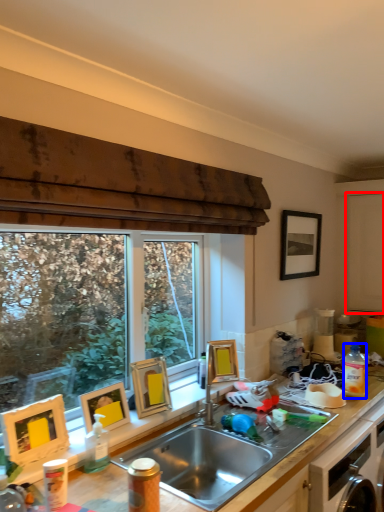
Question: Among these objects, which one is farthest to the camera, screen door (highlighted by a red box) or bottle (highlighted by a blue box)?

Choices:
 (A) screen door
 (B) bottle

Answer: (A)